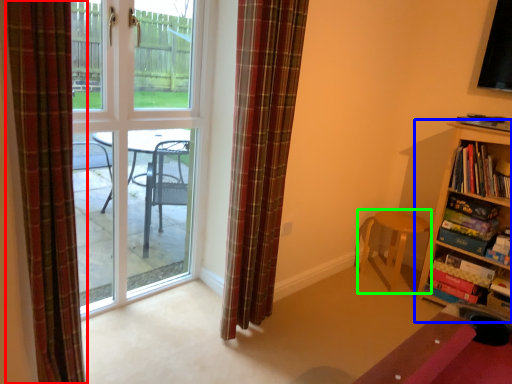
Question: Estimate the real-world distances between objects in this image. Which object is closer to curtain (highlighted by a red box), bookcase (highlighted by a blue box) or chair (highlighted by a green box)?

Choices:
 (A) bookcase
 (B) chair

Answer: (B)